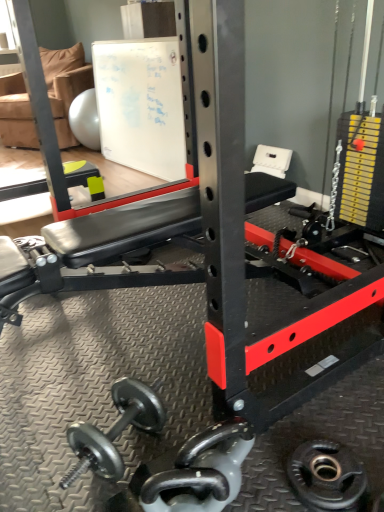
Locate an element on the screen. This screenshot has height=512, width=384. free point above black rubber weight plate at lower right (from a real-world perspective) is located at coordinates (328, 478).